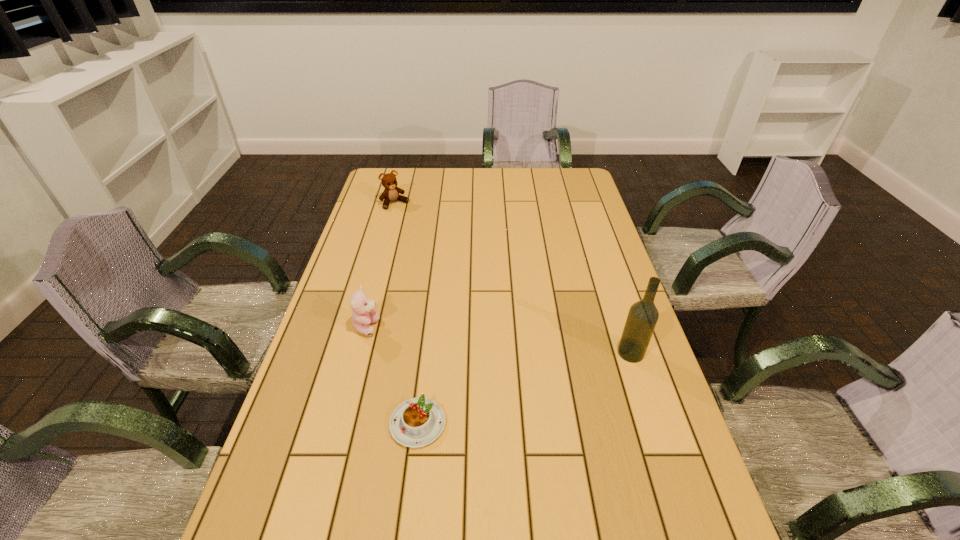
The width and height of the screenshot is (960, 540). Find the location of `free spot between the nearer teddy bear and the nearest object`. free spot between the nearer teddy bear and the nearest object is located at coordinates (393, 376).

Where is `vacant region between the third nearest object and the rightmost object`? vacant region between the third nearest object and the rightmost object is located at coordinates (499, 340).

The image size is (960, 540). I want to click on free space between the third farthest object and the nearest object, so click(x=524, y=388).

The height and width of the screenshot is (540, 960). I want to click on unoccupied position between the farther teddy bear and the shortest object, so click(x=406, y=314).

Find the location of a particular element. free space between the farther teddy bear and the nearest object is located at coordinates (406, 314).

At what (x,y) coordinates should I click in order to perform the action: click on vacant space in between the second object from right to left and the third farthest object. Please return your answer as a coordinate pair (x, y). The image size is (960, 540). Looking at the image, I should click on (524, 388).

Identify the location of vacant region between the pudding and the second nearest object. (524, 388).

Find the location of a particular element. The height and width of the screenshot is (540, 960). vacant space in between the vodka and the third object from left to right is located at coordinates (524, 388).

At what (x,y) coordinates should I click in order to perform the action: click on vacant space that's between the vodka and the nearer teddy bear. Please return your answer as a coordinate pair (x, y). This screenshot has height=540, width=960. Looking at the image, I should click on (499, 340).

The image size is (960, 540). I want to click on free space between the second nearest object and the nearer teddy bear, so click(499, 340).